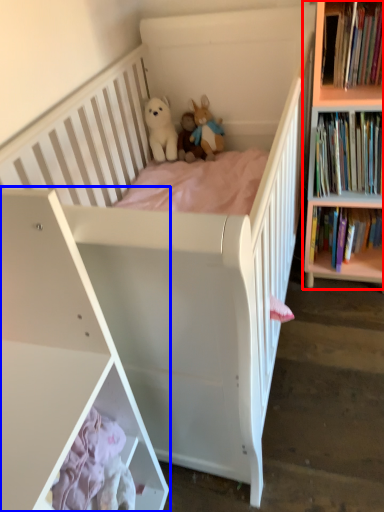
Question: Which object is further to the camera taking this photo, bookcase (highlighted by a red box) or shelf (highlighted by a blue box)?

Choices:
 (A) bookcase
 (B) shelf

Answer: (A)